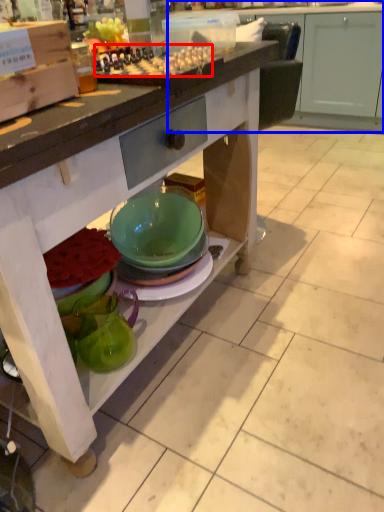
Question: Among these objects, which one is farthest to the camera, food (highlighted by a red box) or cabinetry (highlighted by a blue box)?

Choices:
 (A) food
 (B) cabinetry

Answer: (B)